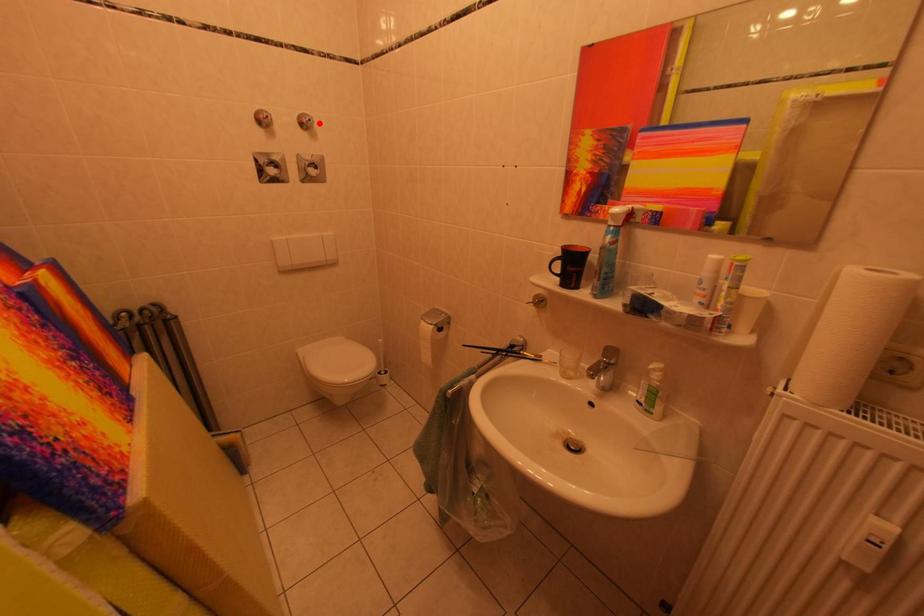
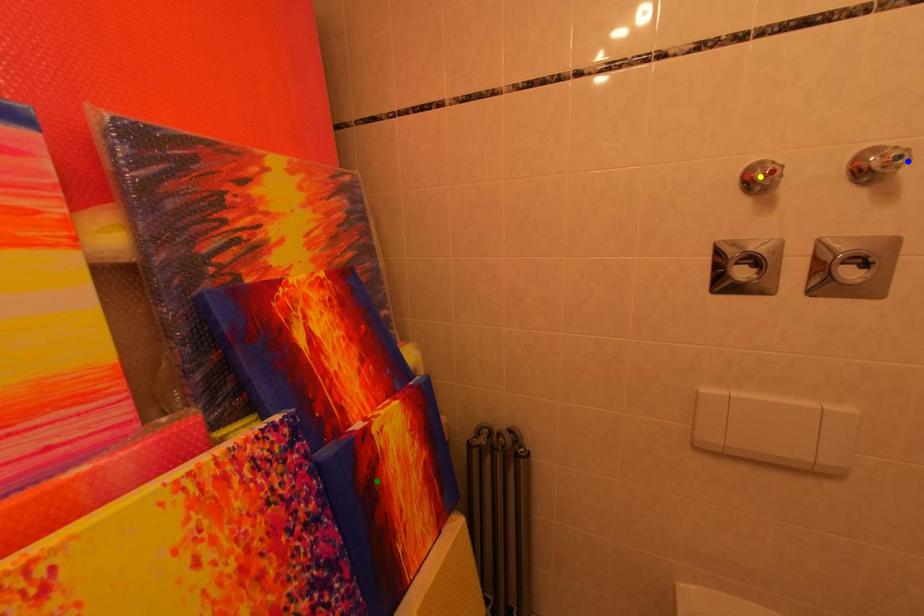
Question: I am providing you with two images of the same scene from different viewpoints. A red point is marked on the first image. You are given multiple points on the second image. Which mark in image 2 goes with the point in image 1?

Choices:
 (A) yellow point
 (B) green point
 (C) blue point

Answer: (C)